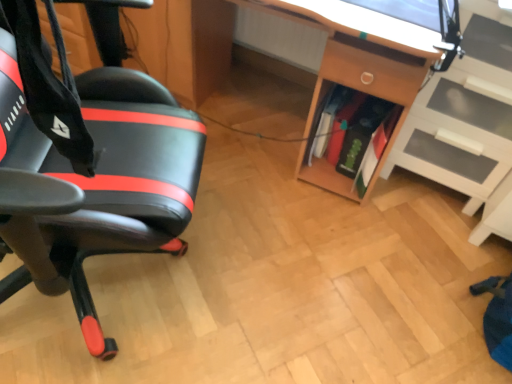
Question: Which direction should I rotate to look at green matte book at center, which appears as the first book when viewed from the back?

Choices:
 (A) right
 (B) left

Answer: (A)

Question: Is green matte book at center, the 3th book from the back, oriented towards green matte book at center, placed as the 3th book when sorted from front to back?

Choices:
 (A) no
 (B) yes

Answer: (A)

Question: Can you confirm if green matte book at center, the 3th book from the back, is shorter than green matte book at center, placed as the 3th book when sorted from front to back?

Choices:
 (A) no
 (B) yes

Answer: (A)

Question: Considering the relative sizes of green matte book at center, acting as the first book starting from the front, and green matte book at center, placed as the 3th book when sorted from front to back, in the image provided, is green matte book at center, acting as the first book starting from the front, thinner than green matte book at center, placed as the 3th book when sorted from front to back,?

Choices:
 (A) yes
 (B) no

Answer: (A)

Question: Is green matte book at center, which appears as the first book when viewed from the back, completely or partially inside green matte book at center, acting as the first book starting from the front?

Choices:
 (A) yes
 (B) no

Answer: (B)

Question: From a real-world perspective, is green matte book at center, acting as the first book starting from the front, on green matte book at center, placed as the 3th book when sorted from front to back?

Choices:
 (A) no
 (B) yes

Answer: (B)

Question: Can you confirm if green matte book at center, the 3th book from the back, is smaller than green matte book at center, placed as the 3th book when sorted from front to back?

Choices:
 (A) yes
 (B) no

Answer: (B)

Question: Is black leather chair at left facing away from wooden desk at center?

Choices:
 (A) no
 (B) yes

Answer: (A)

Question: Considering the relative positions of black leather chair at left and wooden desk at center in the image provided, is black leather chair at left to the right of wooden desk at center from the viewer's perspective?

Choices:
 (A) no
 (B) yes

Answer: (A)

Question: Can you confirm if black leather chair at left is taller than wooden desk at center?

Choices:
 (A) no
 (B) yes

Answer: (B)

Question: Is black leather chair at left positioned behind wooden desk at center?

Choices:
 (A) no
 (B) yes

Answer: (A)

Question: Is black leather chair at left aimed at wooden desk at center?

Choices:
 (A) no
 (B) yes

Answer: (A)

Question: Is the depth of black leather chair at left less than that of wooden desk at center?

Choices:
 (A) no
 (B) yes

Answer: (B)

Question: Is green matte book at center, acting as the first book starting from the front, wider than green matte book at center, which ranks as the 2th book in back-to-front order?

Choices:
 (A) yes
 (B) no

Answer: (B)